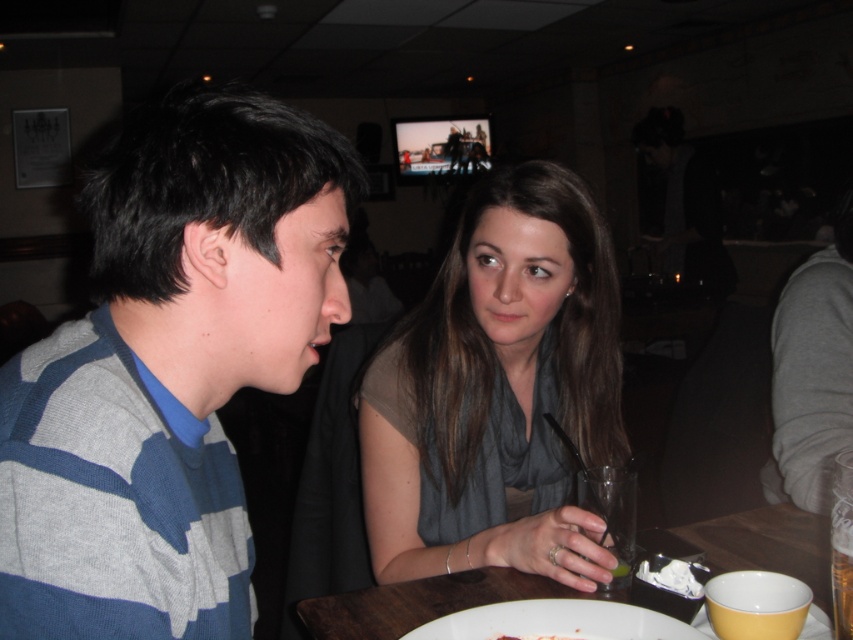
Can you confirm if wooden table at center is smaller than clear glass at lower center?

No.

Between wooden table at center and clear glass at lower center, which one appears on the right side from the viewer's perspective?

wooden table at center is more to the right.

Is point (720, 518) positioned behind point (630, 556)?

Yes, it is behind point (630, 556).

Locate an element on the screen. wooden table at center is located at coordinates (424, 602).

Can you confirm if striped knit sweater at left is bigger than matte gray scarf at center?

Incorrect, striped knit sweater at left is not larger than matte gray scarf at center.

The height and width of the screenshot is (640, 853). Describe the element at coordinates (167, 369) in the screenshot. I see `striped knit sweater at left` at that location.

At what (x,y) coordinates should I click in order to perform the action: click on striped knit sweater at left. Please return your answer as a coordinate pair (x, y). Looking at the image, I should click on (167, 369).

Locate an element on the screen. This screenshot has height=640, width=853. striped knit sweater at left is located at coordinates (167, 369).

Who is more distant from viewer, (769,540) or (517,637)?

The point (769,540) is behind.

The height and width of the screenshot is (640, 853). Find the location of `wooden table at center`. wooden table at center is located at coordinates (424, 602).